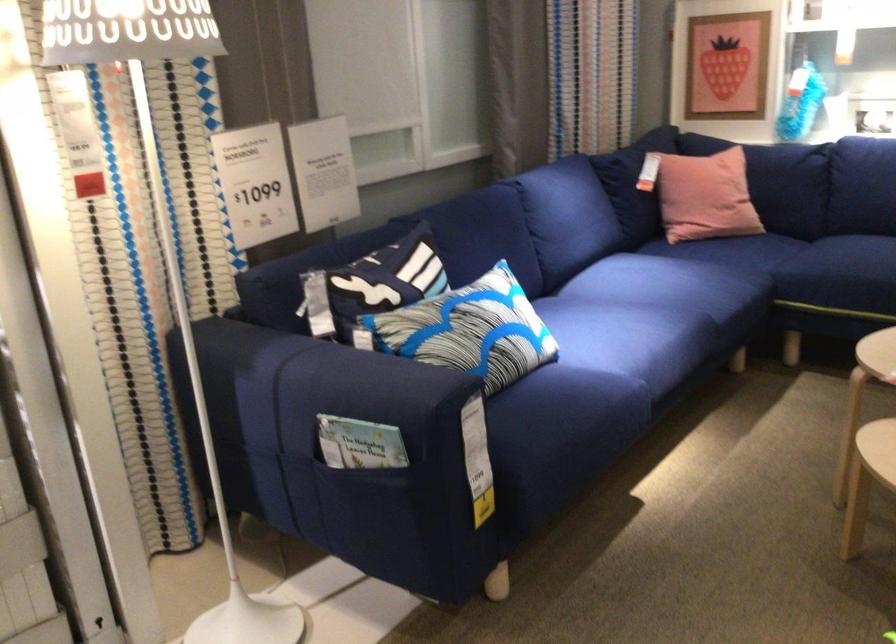
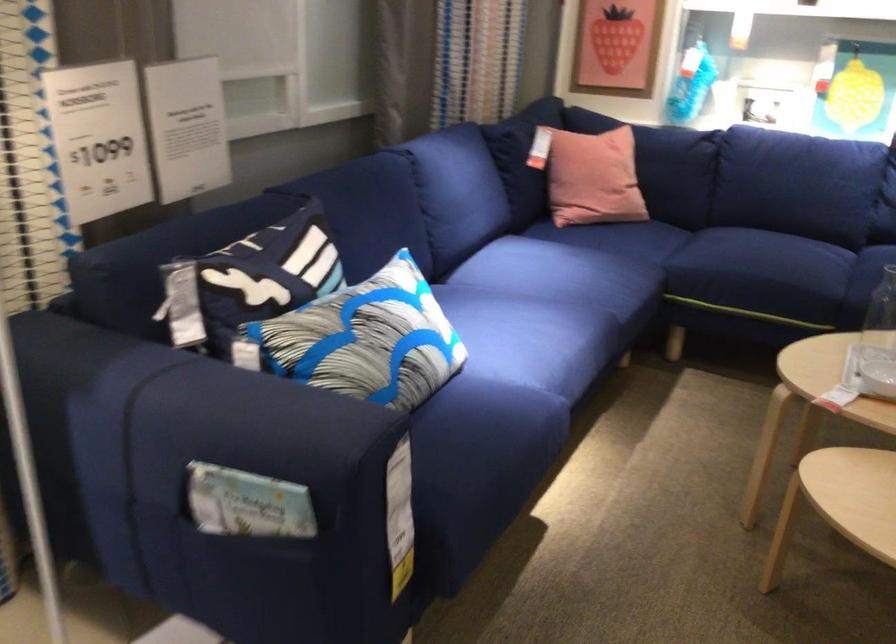
Question: Based on the continuous images, in which direction is the camera rotating? Reply with the corresponding letter.

Choices:
 (A) Left
 (B) Right
 (C) Up
 (D) Down

Answer: (B)